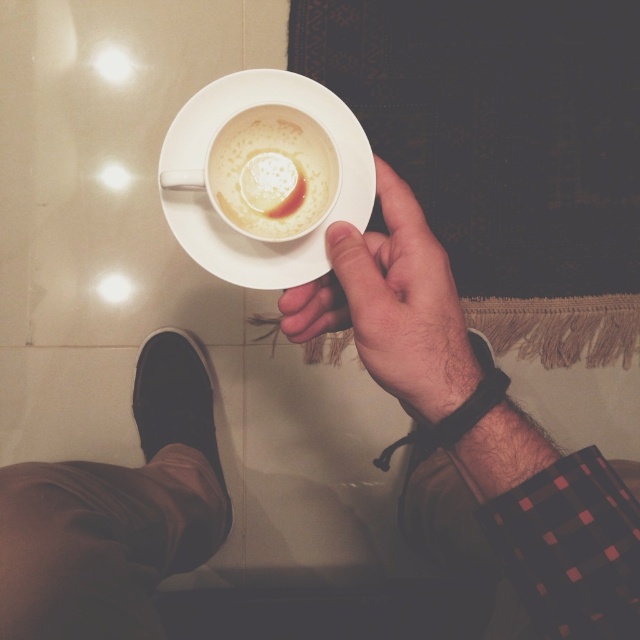
Which of these two, white matte saucer at center or black suede shoe at lower left, stands shorter?

white matte saucer at center is shorter.

Is white matte saucer at center smaller than black suede shoe at lower left?

Correct, white matte saucer at center occupies less space than black suede shoe at lower left.

Is point (214, 228) in front of point (179, 420)?

Yes.

Identify the location of white matte saucer at center. (212, 198).

Is white matte saucer at center positioned in front of white matte cup at center?

Yes, it is.

Can you confirm if white matte saucer at center is positioned above white matte cup at center?

Indeed, white matte saucer at center is positioned over white matte cup at center.

Describe the element at coordinates (212, 198) in the screenshot. I see `white matte saucer at center` at that location.

Identify the location of white matte saucer at center. This screenshot has height=640, width=640. (212, 198).

From the picture: Does smooth skin hand at center have a lesser width compared to black suede shoe at lower left?

Indeed, smooth skin hand at center has a lesser width compared to black suede shoe at lower left.

Describe the element at coordinates (392, 305) in the screenshot. Image resolution: width=640 pixels, height=640 pixels. I see `smooth skin hand at center` at that location.

Image resolution: width=640 pixels, height=640 pixels. In order to click on smooth skin hand at center in this screenshot , I will do `click(392, 305)`.